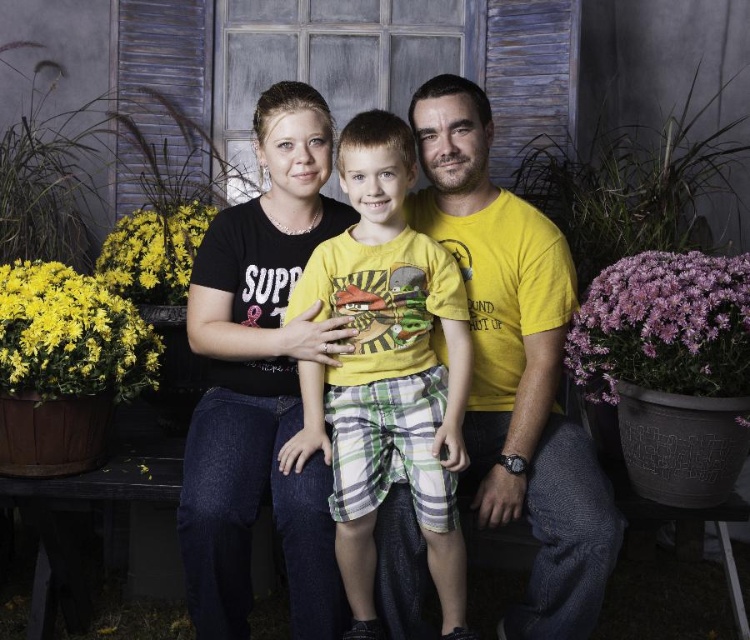
In the image of the family posing outdoors, there are two shirts visible at the center of the scene. The first is a yellow matte shirt at center, and the second is a black corduroy shirt at center. From the perspective of someone facing the family, which shirt is positioned to the right?

The yellow matte shirt at center is positioned to the right of the black corduroy shirt at center.

In the family photo, there are two adults wearing black corduroy shirt at center and yellow cotton shirt at center. Which one is positioned to the left?

The black corduroy shirt at center is positioned to the left of the yellow cotton shirt at center.